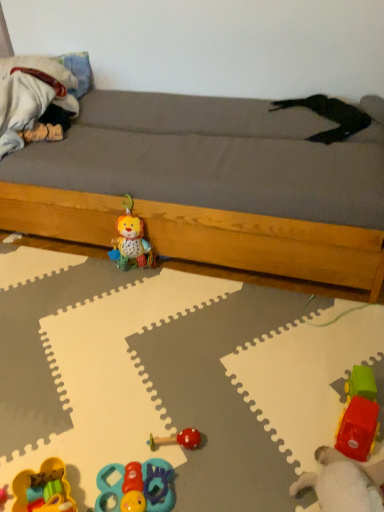
I want to click on vacant space situated above rubberized plastic truck at lower right, the 6th toy positioned from the left (from a real-world perspective), so click(365, 391).